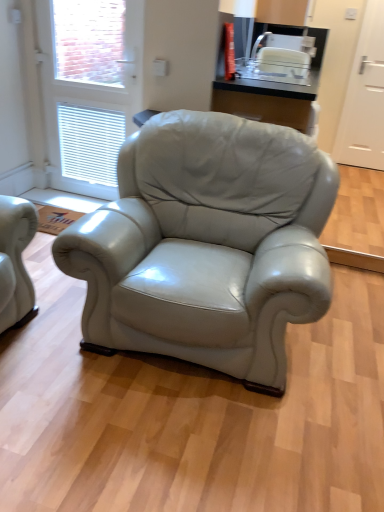
Question: Considering their positions, is white matte door at right, positioned as the first screen door in back-to-front order, located in front of or behind white glossy screen door at upper left, the first screen door when ordered from left to right?

Choices:
 (A) front
 (B) behind

Answer: (B)

Question: Based on their sizes in the image, would you say white matte door at right, the second screen door viewed from the front, is bigger or smaller than white glossy screen door at upper left, the first screen door when ordered from left to right?

Choices:
 (A) small
 (B) big

Answer: (A)

Question: Estimate the real-world distances between objects in this image. Which object is farther from the white glossy screen door at upper left, the first screen door when ordered from left to right?

Choices:
 (A) white matte door at right, the 1th screen door from the right
 (B) white plastic toaster at upper center

Answer: (A)

Question: Estimate the real-world distances between objects in this image. Which object is farther from the white matte door at right, positioned as the first screen door in back-to-front order?

Choices:
 (A) white plastic toaster at upper center
 (B) white glossy screen door at upper left, placed as the 2th screen door when sorted from right to left

Answer: (B)